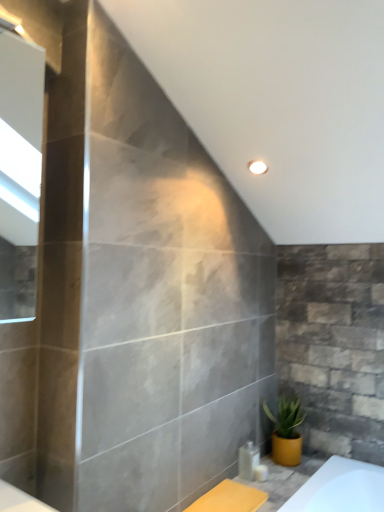
Question: Which is correct: clear plastic bottle at lower right, the 1th toiletry from the left, is inside white glossy soap dispenser at lower center, the 1th toiletry in the right-to-left sequence, or outside of it?

Choices:
 (A) outside
 (B) inside

Answer: (A)

Question: From their relative heights in the image, would you say clear plastic bottle at lower right, the 1th toiletry from the left, is taller or shorter than white glossy soap dispenser at lower center, the 1th toiletry in the right-to-left sequence?

Choices:
 (A) short
 (B) tall

Answer: (B)

Question: Which object is the farthest from the clear plastic bottle at lower right, the 1th toiletry from the left?

Choices:
 (A) white glossy soap dispenser at lower center, the 1th toiletry in the right-to-left sequence
 (B) yellow matte pot at lower right

Answer: (B)

Question: Considering the real-world distances, which object is closest to the white glossy soap dispenser at lower center, which is the second toiletry in left-to-right order?

Choices:
 (A) clear plastic bottle at lower right, the 1th toiletry from the left
 (B) yellow matte pot at lower right

Answer: (A)